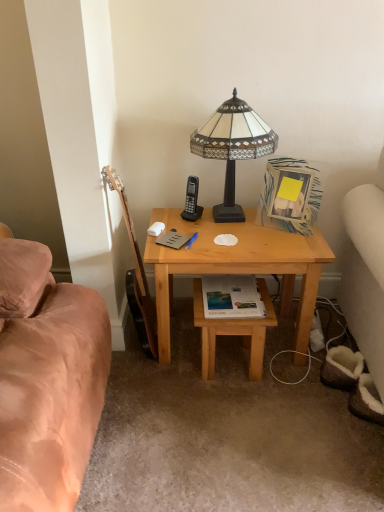
Identify the location of free spot in front of light wood desk at center. The width and height of the screenshot is (384, 512). (240, 428).